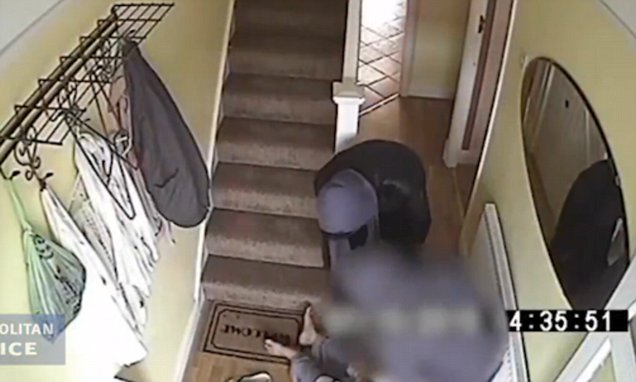
Locate an element on the screen. The image size is (636, 382). doormat is located at coordinates (254, 328).